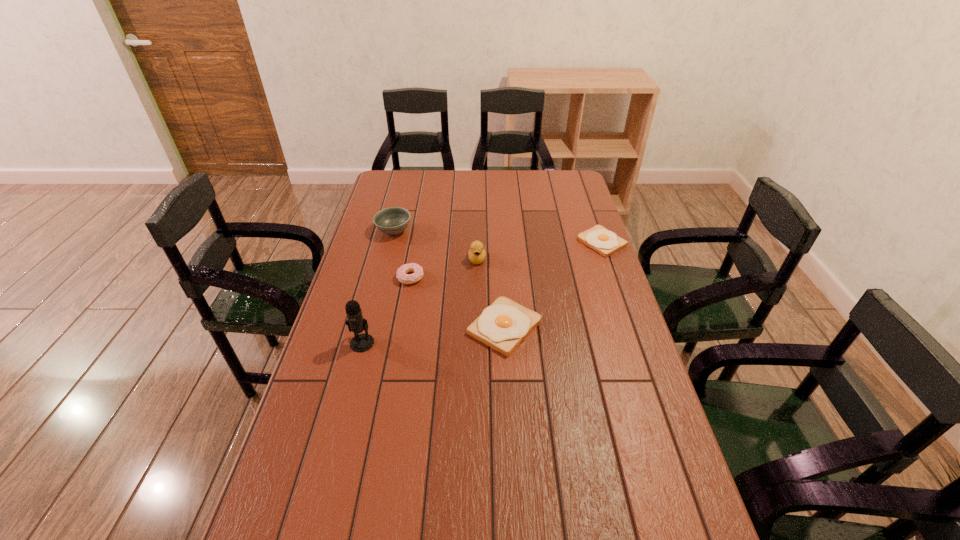
Where is `vacant area between the second tallest object and the shorter toast`? vacant area between the second tallest object and the shorter toast is located at coordinates (540, 251).

You are a GUI agent. You are given a task and a screenshot of the screen. Output one action in this format:
    pyautogui.click(x=<x>, y=<y>)
    Task: Click on the second closest object to the third nearest object
    This screenshot has width=960, height=540.
    Given the screenshot: What is the action you would take?
    pyautogui.click(x=393, y=220)

Locate which object is the fifth closest to the duckling. Please provide its 2D coordinates. Your answer should be formatted as a tuple, i.e. [(x, y)], where the tuple contains the x and y coordinates of a point satisfying the conditions above.

[(356, 323)]

Image resolution: width=960 pixels, height=540 pixels. I want to click on free point that satisfies the following two spatial constraints: 1. on the front side of the doughnut; 2. on the left side of the taller toast, so pyautogui.click(x=402, y=327).